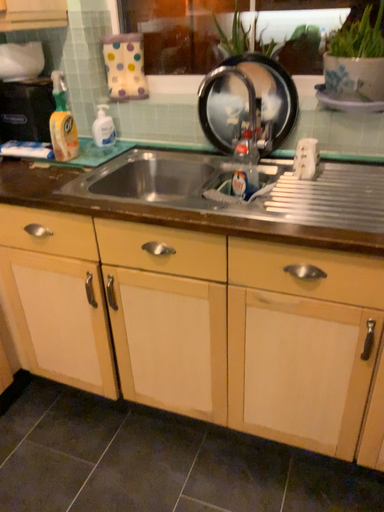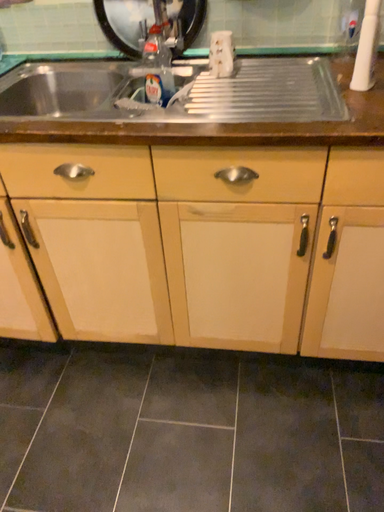
Question: Which way did the camera rotate in the video?

Choices:
 (A) rotated downward
 (B) rotated upward

Answer: (A)